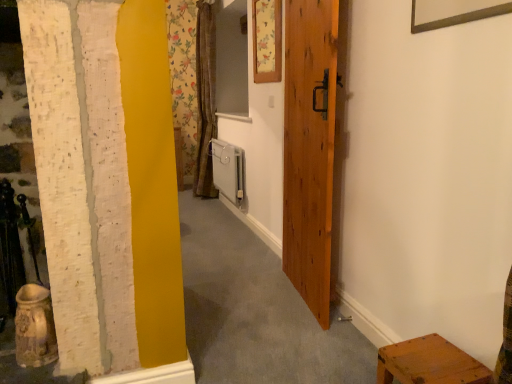
Question: Is wooden stool at lower right bigger or smaller than floral paper picture frame at upper center?

Choices:
 (A) big
 (B) small

Answer: (A)

Question: In the image, is wooden stool at lower right positioned in front of or behind floral paper picture frame at upper center?

Choices:
 (A) behind
 (B) front

Answer: (B)

Question: Estimate the real-world distances between objects in this image. Which object is closer to the wooden stool at lower right?

Choices:
 (A) wooden door at center
 (B) white plastic radiator at center
 (C) floral paper picture frame at upper center

Answer: (A)

Question: Estimate the real-world distances between objects in this image. Which object is closer to the wooden stool at lower right?

Choices:
 (A) floral paper picture frame at upper center
 (B) white plastic radiator at center
 (C) wooden door at center

Answer: (C)